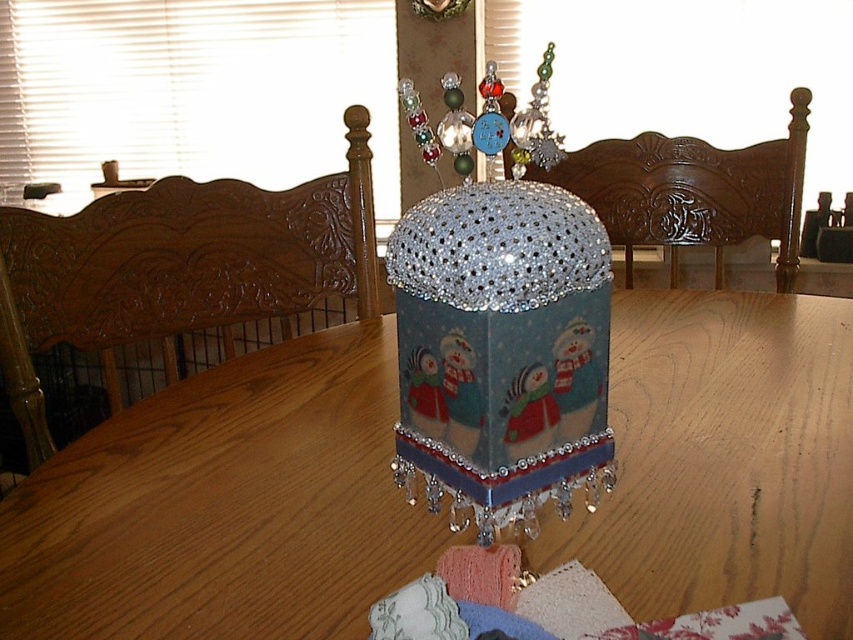
Is wooden table at center to the right of glittery plastic snowman at center from the viewer's perspective?

Yes, wooden table at center is to the right of glittery plastic snowman at center.

Does wooden table at center have a lesser width compared to glittery plastic snowman at center?

No.

Is point (256, 564) farther from camera compared to point (405, 292)?

Yes, it is behind point (405, 292).

Image resolution: width=853 pixels, height=640 pixels. I want to click on wooden table at center, so click(x=225, y=506).